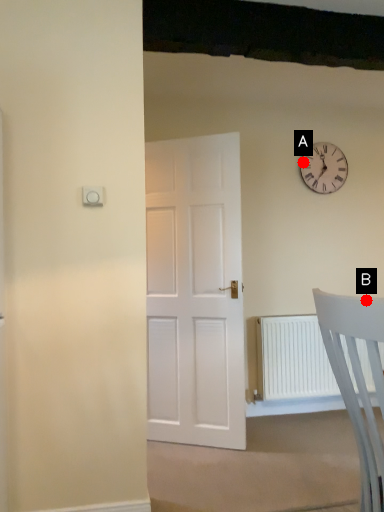
Question: Two points are circled on the image, labeled by A and B beside each circle. Which point is further to the camera?

Choices:
 (A) A is further
 (B) B is further

Answer: (A)